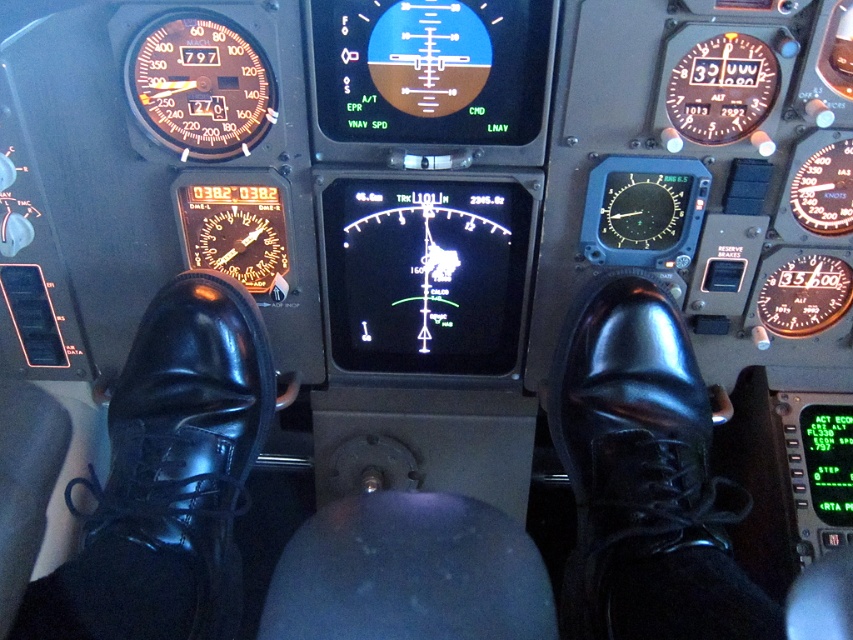
You are a flight attendant who needs to reach the emergency brake lever located on the center console. You are currently standing next to the shiny black shoe at lower left. Which direction should you move to reach the black leather shoe at center?

The black leather shoe at center is positioned on the right side of the shiny black shoe at lower left, so you should move to your right to reach it.

You are a flight attendant checking the cockpit for safety. You notice the black leather shoe at center and the shiny black shoe at lower left. Which shoe has a narrower width?

The black leather shoe at center is thinner than the shiny black shoe at lower left, so the black leather shoe at center has a narrower width.